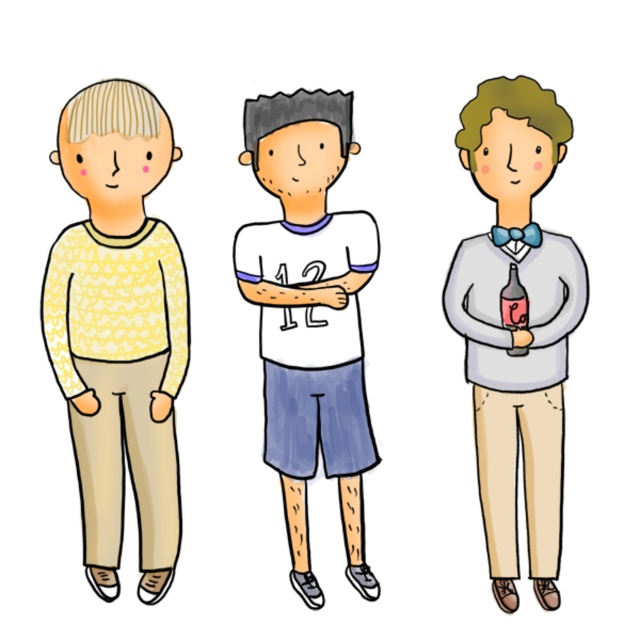
Question: Does matte gray sweater at right have a greater width compared to translucent glass bottle at center?

Choices:
 (A) yes
 (B) no

Answer: (A)

Question: Estimate the real-world distances between objects in this image. Which object is closer to the translucent glass bottle at center?

Choices:
 (A) matte gray sweater at right
 (B) yellow textured sweater at left

Answer: (A)

Question: Which point appears closest to the camera in this image?

Choices:
 (A) (515, 353)
 (B) (100, 525)
 (C) (342, 152)
 (D) (516, 541)

Answer: (D)

Question: Among these points, which one is farthest from the camera?

Choices:
 (A) (301, 378)
 (B) (108, 346)
 (C) (532, 460)
 (D) (499, 308)

Answer: (A)

Question: Can you confirm if matte gray sweater at right is positioned below white jersey at center?

Choices:
 (A) yes
 (B) no

Answer: (B)

Question: Does matte gray sweater at right have a smaller size compared to white jersey at center?

Choices:
 (A) yes
 (B) no

Answer: (B)